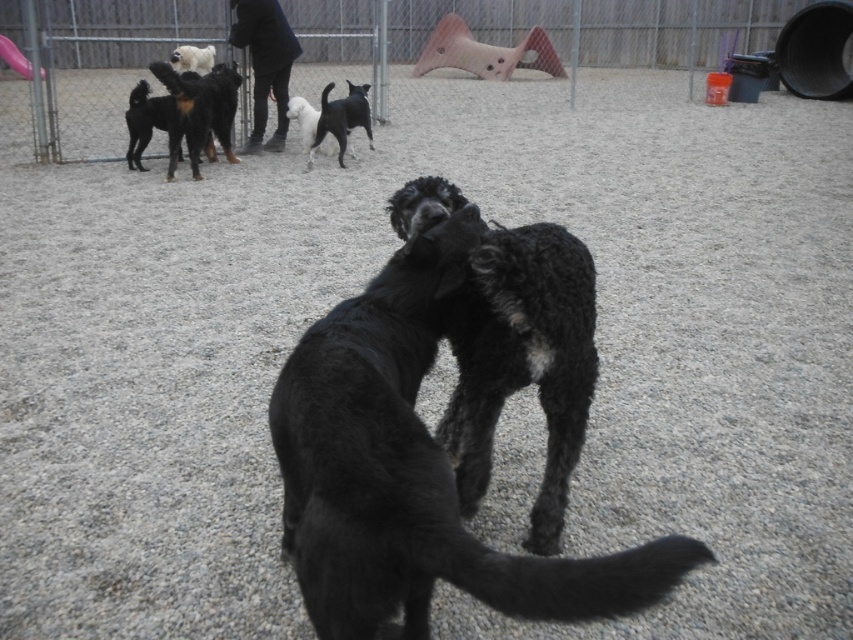
Does metal fence at upper center have a greater width compared to white fluffy dog at center?

Yes, metal fence at upper center is wider than white fluffy dog at center.

Looking at this image, between metal fence at upper center and white fluffy dog at center, which one is positioned higher?

metal fence at upper center is above.

What do you see at coordinates (540, 28) in the screenshot?
I see `metal fence at upper center` at bounding box center [540, 28].

Identify the location of metal fence at upper center. (540, 28).

Does black curly fur dog at center have a smaller size compared to white fluffy dog at upper left?

No.

Between black curly fur dog at center and white fluffy dog at upper left, which one is positioned higher?

white fluffy dog at upper left

Who is more distant from viewer, (312,520) or (180,65)?

The point (180,65) is behind.

The width and height of the screenshot is (853, 640). Find the location of `black curly fur dog at center`. black curly fur dog at center is located at coordinates (412, 472).

Does point (454, 579) lie behind point (352, 113)?

No, it is not.

Based on the photo, who is lower down, black curly fur dog at center or black matte dog at upper center?

black curly fur dog at center is below.

Who is more distant from viewer, [280,467] or [332,122]?

Point [332,122]

At what (x,y) coordinates should I click in order to perform the action: click on black curly fur dog at center. Please return your answer as a coordinate pair (x, y). The image size is (853, 640). Looking at the image, I should click on (412, 472).